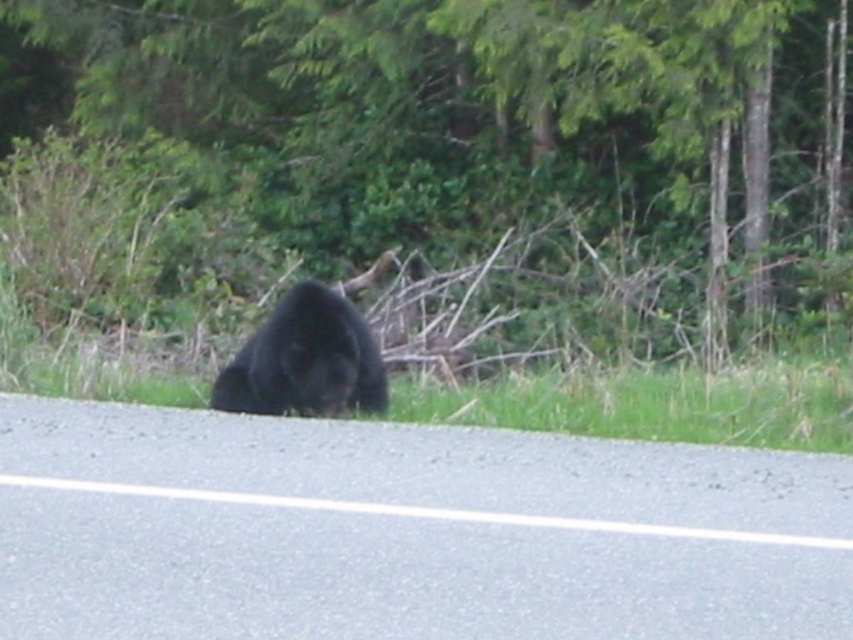
Does green leafy tree at center appear under black fur bear at center?

Actually, green leafy tree at center is above black fur bear at center.

Can you confirm if green leafy tree at center is bigger than black fur bear at center?

Indeed, green leafy tree at center has a larger size compared to black fur bear at center.

The width and height of the screenshot is (853, 640). What are the coordinates of `green leafy tree at center` in the screenshot? It's located at (442, 157).